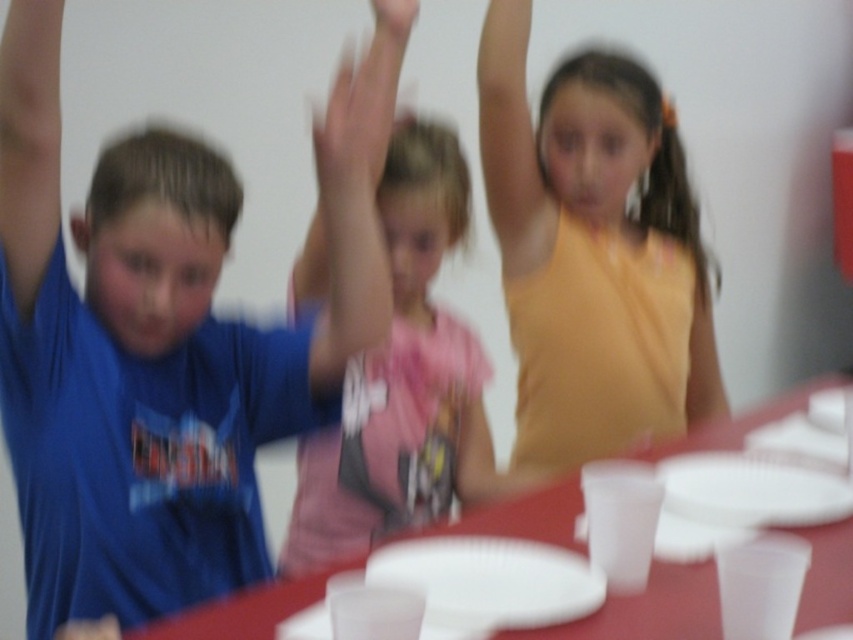
Does point (695, 396) lie behind point (502, 252)?

That is True.

Between yellow matte tank top at upper center and matte yellow arm at upper center, which one has less height?

matte yellow arm at upper center

Who is more forward, (521, 200) or (495, 92)?

Point (495, 92)

Locate an element on the screen. yellow matte tank top at upper center is located at coordinates (593, 252).

Does white plastic plate at center have a smaller size compared to white paper plate at lower right?

Indeed, white plastic plate at center has a smaller size compared to white paper plate at lower right.

How far apart are white plastic plate at center and white paper plate at lower right?

white plastic plate at center and white paper plate at lower right are 12.66 inches apart.

Based on the photo, measure the distance between point (575, 593) and camera.

Point (575, 593) and camera are 1.03 meters apart from each other.

Image resolution: width=853 pixels, height=640 pixels. Identify the location of white plastic plate at center. (490, 580).

Between white plastic plate at center and matte yellow arm at upper center, which one appears on the right side from the viewer's perspective?

matte yellow arm at upper center is more to the right.

Is white plastic plate at center wider than matte yellow arm at upper center?

Yes, white plastic plate at center is wider than matte yellow arm at upper center.

Between point (497, 579) and point (531, 266), which one is positioned behind?

The point (531, 266) is behind.

At what (x,y) coordinates should I click in order to perform the action: click on white plastic plate at center. Please return your answer as a coordinate pair (x, y). This screenshot has height=640, width=853. Looking at the image, I should click on (490, 580).